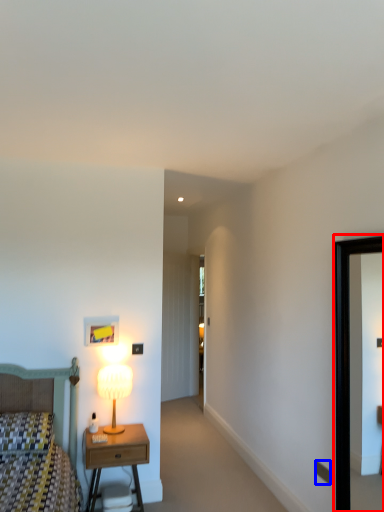
Question: Which object appears farthest to the camera in this image, picture frame (highlighted by a red box) or electric outlet (highlighted by a blue box)?

Choices:
 (A) picture frame
 (B) electric outlet

Answer: (B)